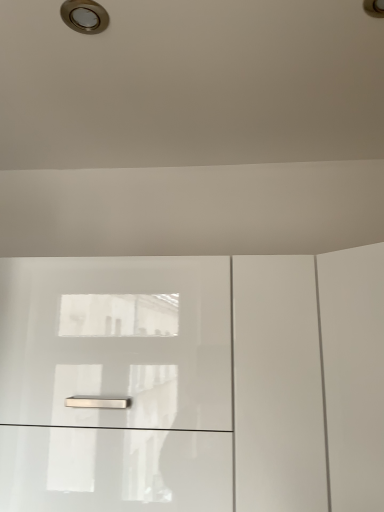
Find the location of `vacant area to the right of brushed metal droplight at upper left`. vacant area to the right of brushed metal droplight at upper left is located at coordinates (164, 34).